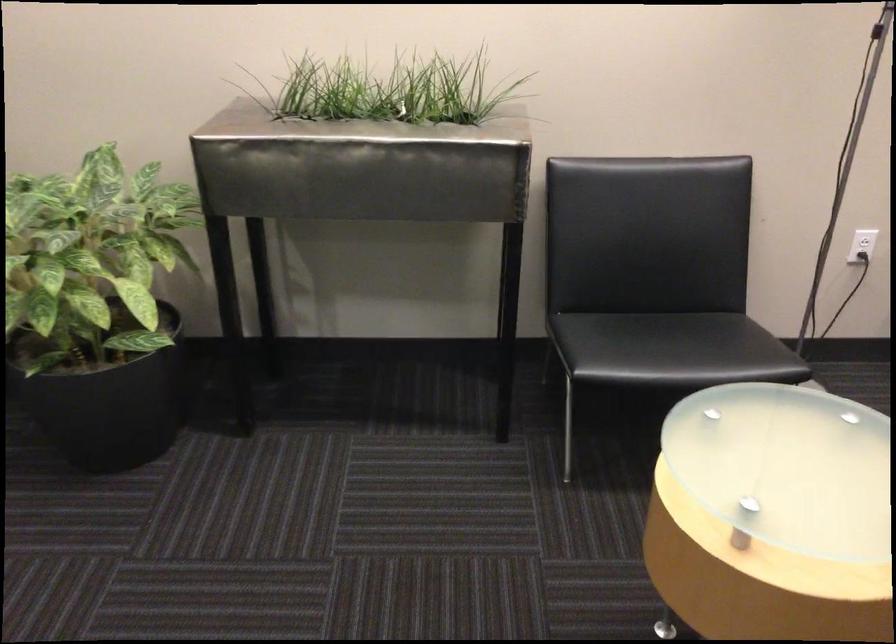
This screenshot has height=644, width=896. What are the coordinates of `black power plug` in the screenshot? It's located at (863, 258).